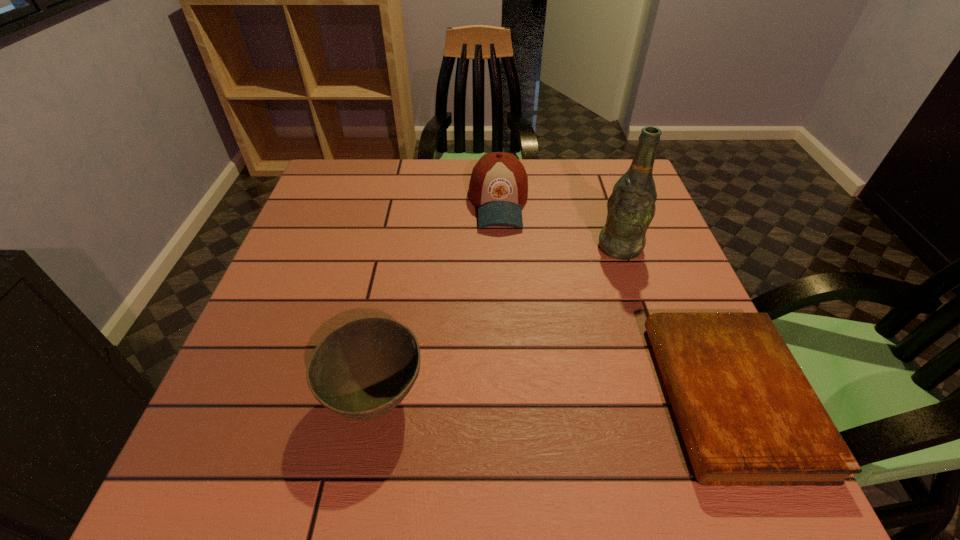
This screenshot has height=540, width=960. Find the location of `free point located on the surface of the tallest object`. free point located on the surface of the tallest object is located at coordinates (600, 274).

Where is `vacant space situated on the front-facing side of the baseball cap`? This screenshot has height=540, width=960. vacant space situated on the front-facing side of the baseball cap is located at coordinates (505, 306).

Where is `free spot located 0.120m on the front-facing side of the baseball cap`? free spot located 0.120m on the front-facing side of the baseball cap is located at coordinates (503, 267).

What are the coordinates of `vacant space located 0.300m on the front-facing side of the baseball cap` in the screenshot? It's located at (507, 328).

The height and width of the screenshot is (540, 960). I want to click on object at the far edge, so click(x=498, y=185).

At what (x,y) coordinates should I click in order to perform the action: click on bowl present at the near edge. Please return your answer as a coordinate pair (x, y). This screenshot has width=960, height=540. Looking at the image, I should click on (363, 369).

This screenshot has height=540, width=960. Identify the location of Bible that is at the near edge. (748, 416).

Where is `Bible present at the right edge`? Bible present at the right edge is located at coordinates (748, 416).

Where is `beer bottle located in the right edge section of the desktop`? This screenshot has width=960, height=540. beer bottle located in the right edge section of the desktop is located at coordinates (631, 207).

Locate an element on the screen. object positioned at the near right corner is located at coordinates (748, 416).